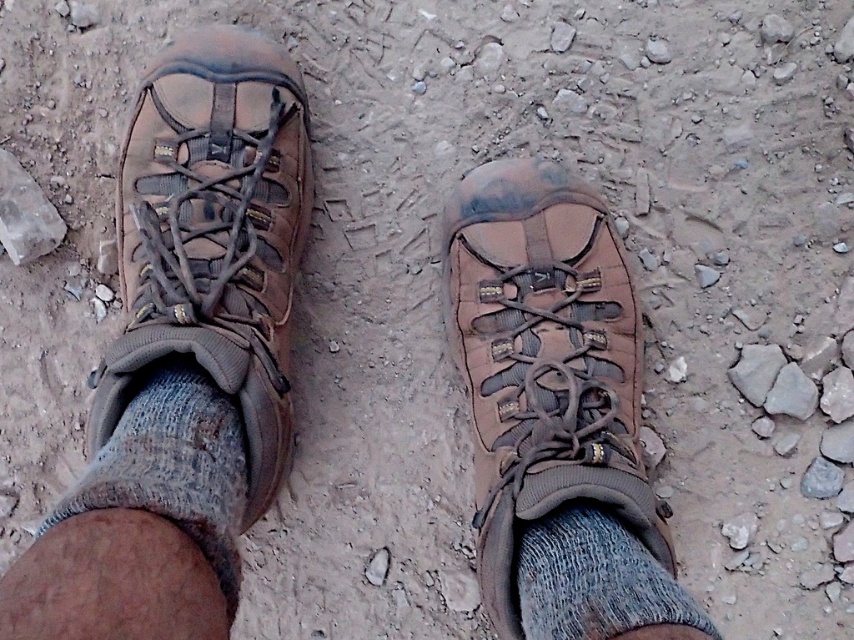
Question: Can you confirm if matte brown hiking boot at left is positioned below gray rock at center?

Choices:
 (A) yes
 (B) no

Answer: (B)

Question: Which of the following is the closest to the observer?

Choices:
 (A) matte brown hiking boot at left
 (B) gray rock at center

Answer: (A)

Question: Considering the real-world distances, which object is closest to the gray rock at lower right?

Choices:
 (A) gray knitted sock at lower left
 (B) brown leather shoe at center
 (C) gray rock at center

Answer: (C)

Question: Does matte brown hiking boot at left appear over brown leather shoe at center?

Choices:
 (A) yes
 (B) no

Answer: (A)

Question: Among these points, which one is nearest to the camera?

Choices:
 (A) (519, 605)
 (B) (741, 378)

Answer: (A)

Question: In this image, where is brown leather shoe at center located relative to gray rock at lower right?

Choices:
 (A) below
 (B) above

Answer: (B)